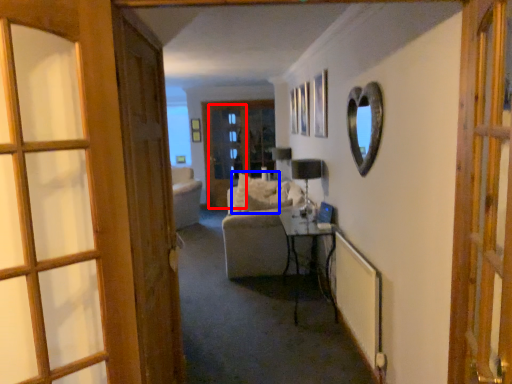
Question: Which of the following is the farthest to the observer, screen door (highlighted by a red box) or pillow (highlighted by a blue box)?

Choices:
 (A) screen door
 (B) pillow

Answer: (A)